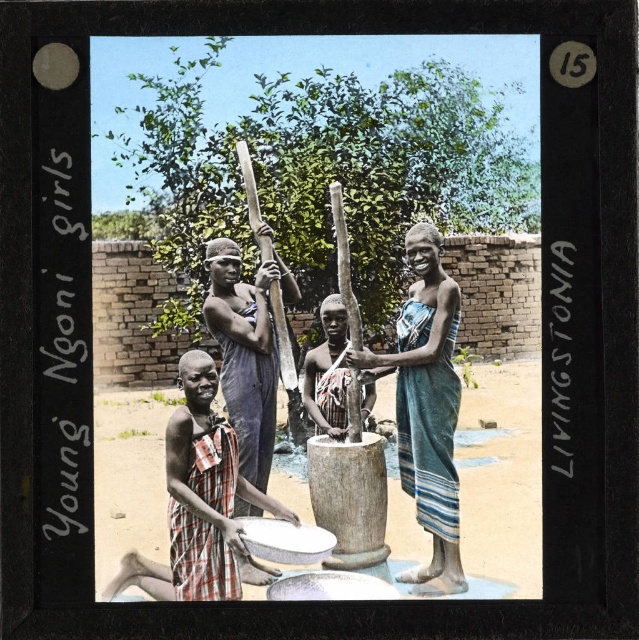
Which is behind, point (300, 476) or point (263, 310)?

Point (263, 310)

This screenshot has width=639, height=640. What do you see at coordinates (500, 481) in the screenshot?
I see `brown dirt field at lower center` at bounding box center [500, 481].

Find the location of a particular element. Image resolution: width=639 pixels, height=640 pixels. brown dirt field at lower center is located at coordinates (500, 481).

This screenshot has height=640, width=639. What are the coordinates of `brown dirt field at lower center` in the screenshot? It's located at (500, 481).

Can you confirm if brown dirt field at lower center is wider than blue striped cloth at center?

In fact, brown dirt field at lower center might be narrower than blue striped cloth at center.

Does point (137, 497) lie behind point (412, 355)?

Yes.

The height and width of the screenshot is (640, 639). What are the coordinates of `brown dirt field at lower center` in the screenshot? It's located at (500, 481).

Between blue striped cloth at center and dark brown wood staff at center, which one has more height?

With more height is blue striped cloth at center.

Does point (442, 509) come in front of point (259, 282)?

That is True.

Which is behind, point (429, 420) or point (219, 292)?

Positioned behind is point (219, 292).

Image resolution: width=639 pixels, height=640 pixels. What are the coordinates of `blue striped cloth at center` in the screenshot? It's located at (426, 406).